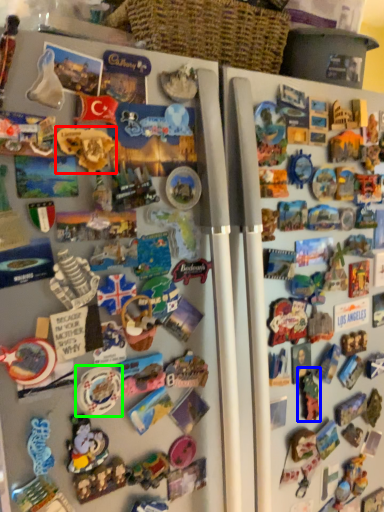
Question: Which object is positioned closest to toy (highlighted by a red box)? Select from toy (highlighted by a blue box) and toy (highlighted by a green box).

Choices:
 (A) toy
 (B) toy

Answer: (B)